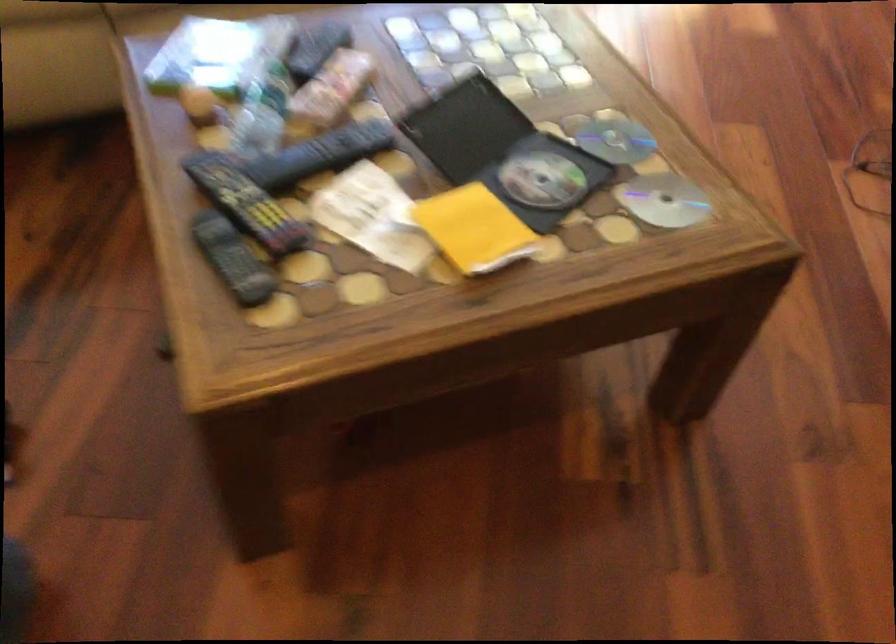
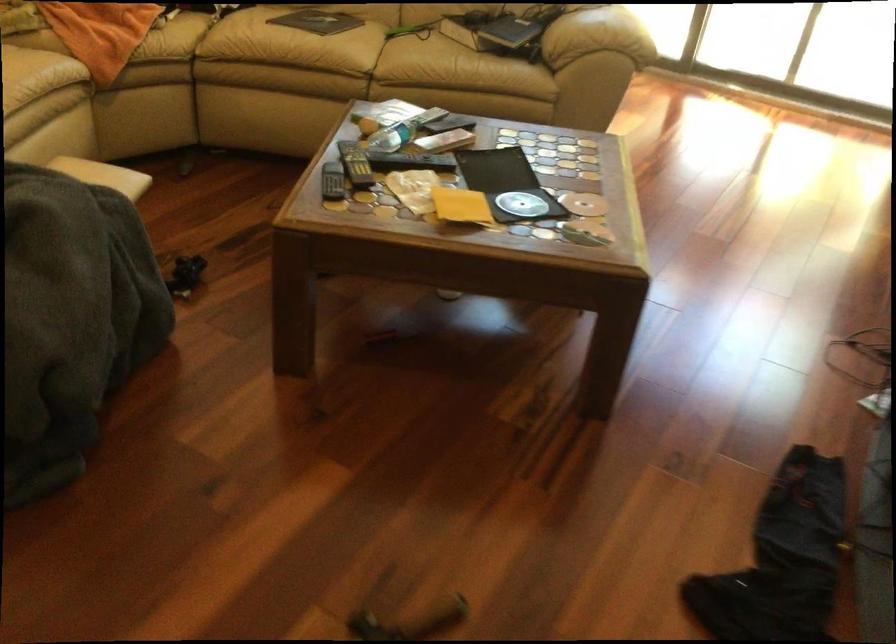
In the second image, find the point that corresponds to pixel 257 207 in the first image.

(355, 164)